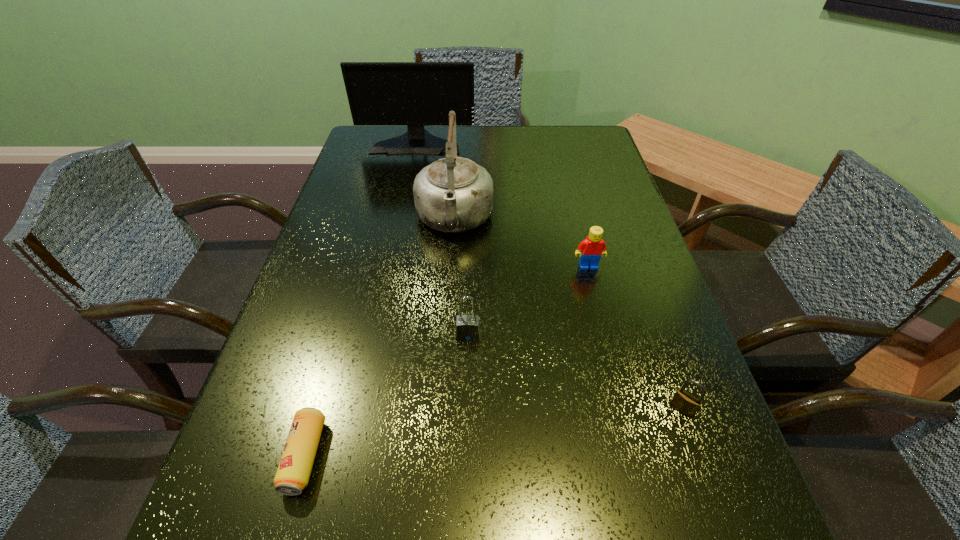
Locate an element on the screen. The width and height of the screenshot is (960, 540). monitor is located at coordinates (415, 94).

Find the location of a particular element. kettle is located at coordinates (454, 194).

Image resolution: width=960 pixels, height=540 pixels. Identify the location of Lego. (590, 250).

Find the location of a particular element. This screenshot has height=540, width=960. the second object from right to left is located at coordinates (590, 250).

At what (x,y) coordinates should I click in order to perform the action: click on the taller padlock. Please return your answer as a coordinate pair (x, y). This screenshot has height=540, width=960. Looking at the image, I should click on (467, 326).

The height and width of the screenshot is (540, 960). In order to click on the left padlock in this screenshot , I will do `click(467, 326)`.

The image size is (960, 540). In order to click on the rightmost object in this screenshot , I will do `click(683, 401)`.

Find the location of a particular element. The width and height of the screenshot is (960, 540). the nearer padlock is located at coordinates (683, 401).

This screenshot has width=960, height=540. What are the coordinates of `the shortest object` in the screenshot? It's located at (293, 473).

Identify the location of the nearest object. The image size is (960, 540). (293, 473).